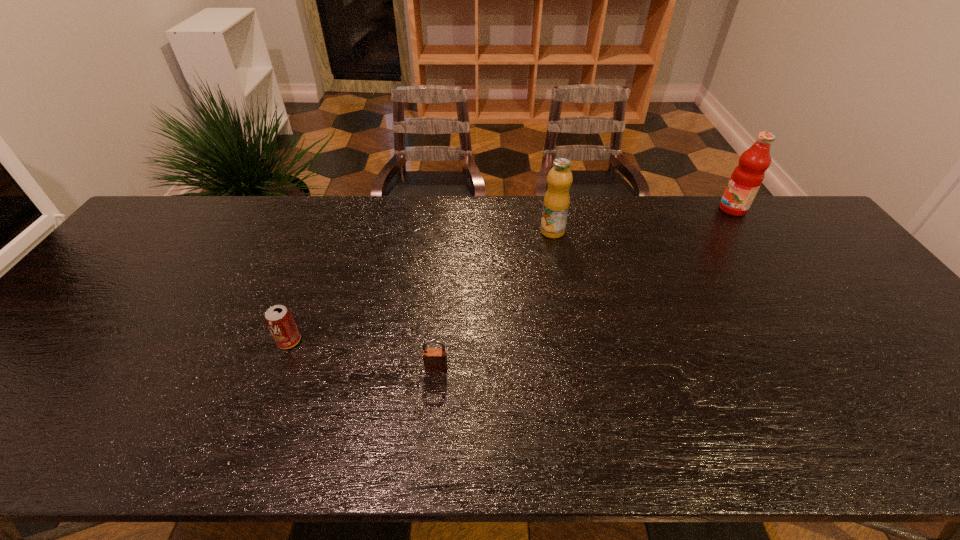
This screenshot has width=960, height=540. Identify the location of empty location between the farther fruit juice and the third object from right to left. (585, 288).

Identify the location of vacant area that lies between the third object from left to right and the farther fruit juice. The image size is (960, 540). (642, 220).

Locate an element on the screen. The height and width of the screenshot is (540, 960). vacant point located between the nearest object and the farthest object is located at coordinates (585, 288).

Where is `vacant area that lies between the second nearest object and the nearest object`? vacant area that lies between the second nearest object and the nearest object is located at coordinates (363, 354).

Locate an element on the screen. free area in between the second nearest object and the right fruit juice is located at coordinates (511, 275).

This screenshot has width=960, height=540. I want to click on free space between the third nearest object and the second nearest object, so click(420, 286).

Where is `free area in between the third object from right to left and the nearer fruit juice`? free area in between the third object from right to left and the nearer fruit juice is located at coordinates (494, 300).

Locate an element on the screen. vacant point located between the padlock and the farthest object is located at coordinates (585, 288).

At what (x,y) coordinates should I click in order to perform the action: click on free space between the second nearest object and the right fruit juice. Please return your answer as a coordinate pair (x, y). The width and height of the screenshot is (960, 540). Looking at the image, I should click on (511, 275).

I want to click on unoccupied area between the nearest object and the rightmost object, so click(585, 288).